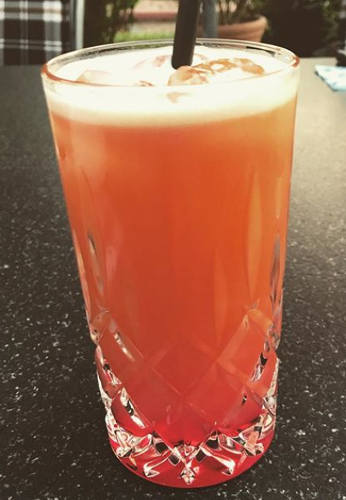
In order to click on potted plant in this screenshot , I will do `click(253, 35)`.